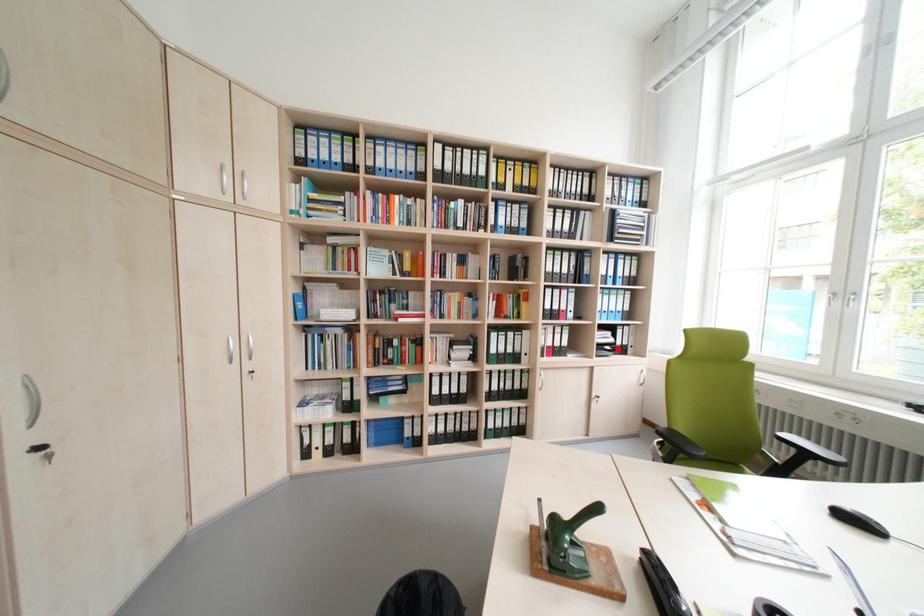
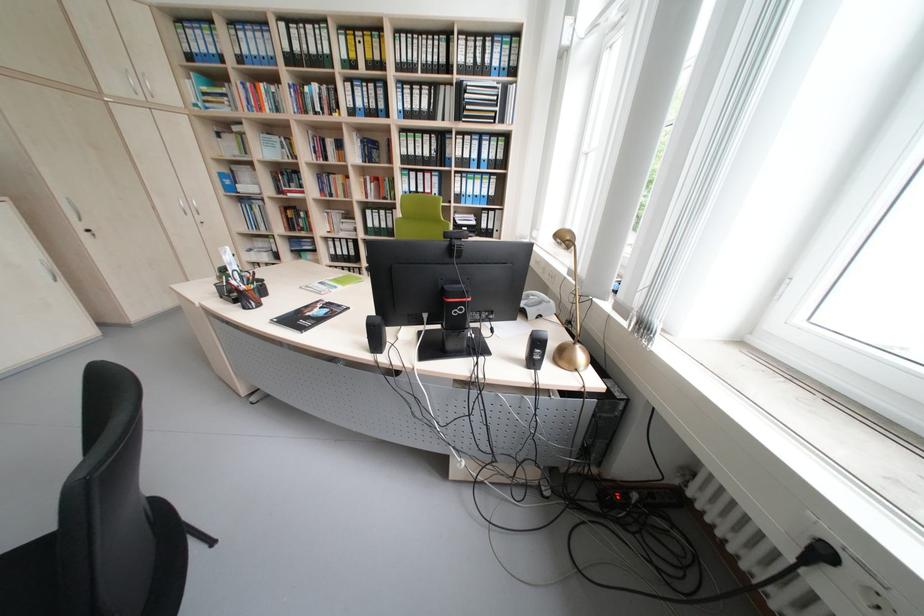
The point at the highlighted location is marked in the first image. Where is the corresponding point in the second image?

(476, 230)